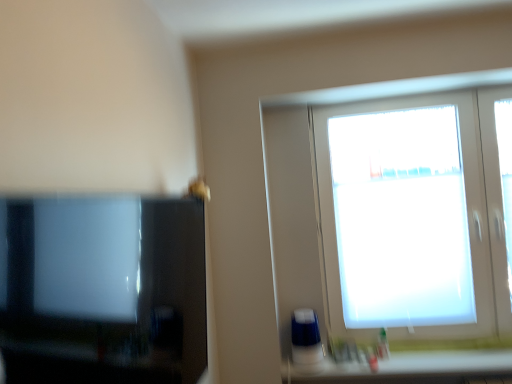
Locate an element on the screen. free space above white plastic container at lower right (from a real-world perspective) is located at coordinates (428, 357).